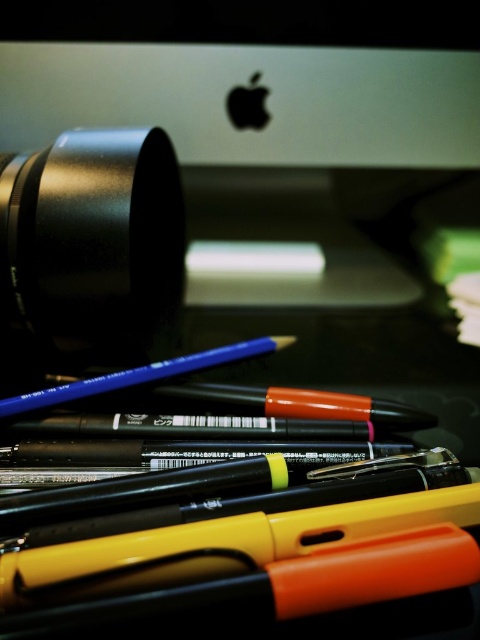
You are trying to locate the sleek silver desktop at upper center in the image. Based on the coordinates provided, where would you find it?

The sleek silver desktop at upper center is located at the coordinates point (251, 77).

You are organizing a desk and need to place two stickers at the positions of point (199, 115) and point (15, 298). According to the desk setup, which point is closer to the front of the desk?

Point (15, 298) is closer to the front of the desk because it is in front of point (199, 115), which is positioned behind it.

You are organizing your desk and need to place a new item between the sleek silver desktop at upper center and the black matte camera lens at upper left. Considering their sizes, which object should you place the item closer to if you want it to be more visible?

The sleek silver desktop at upper center has a larger size compared to the black matte camera lens at upper left. To make the item more visible, place it closer to the sleek silver desktop at upper center since its larger size provides more space and visibility.